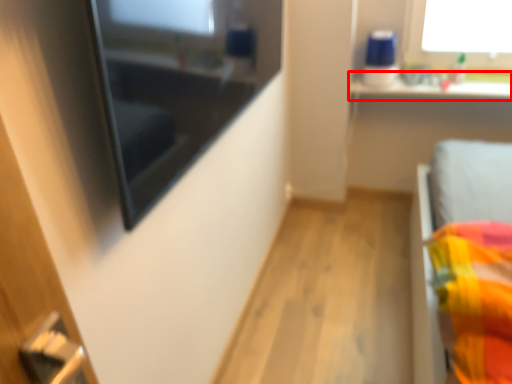
Question: From the image's perspective, what is the correct spatial positioning of window sill (annotated by the red box) in reference to medicine cabinet?

Choices:
 (A) above
 (B) below

Answer: (A)